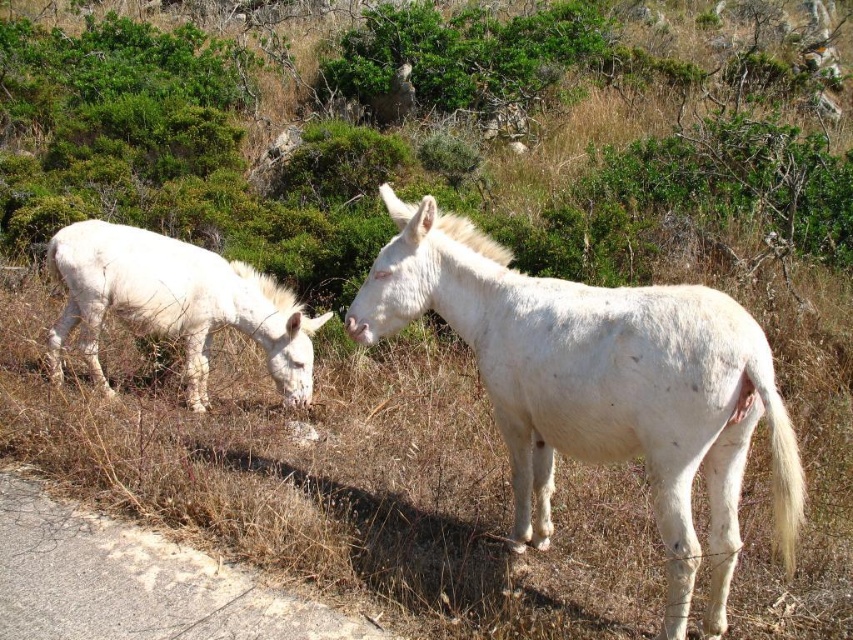
Question: In this image, where is white matte donkey at center located relative to white matte donkey at left?

Choices:
 (A) right
 (B) left

Answer: (A)

Question: Is white matte donkey at center smaller than white matte donkey at left?

Choices:
 (A) no
 (B) yes

Answer: (A)

Question: Observing the image, what is the correct spatial positioning of white matte donkey at center in reference to white matte donkey at left?

Choices:
 (A) above
 (B) below

Answer: (B)

Question: Which point is farther from the camera taking this photo?

Choices:
 (A) (115, 275)
 (B) (531, 353)

Answer: (A)

Question: Which point is farther from the camera taking this photo?

Choices:
 (A) (189, 340)
 (B) (743, 460)

Answer: (A)